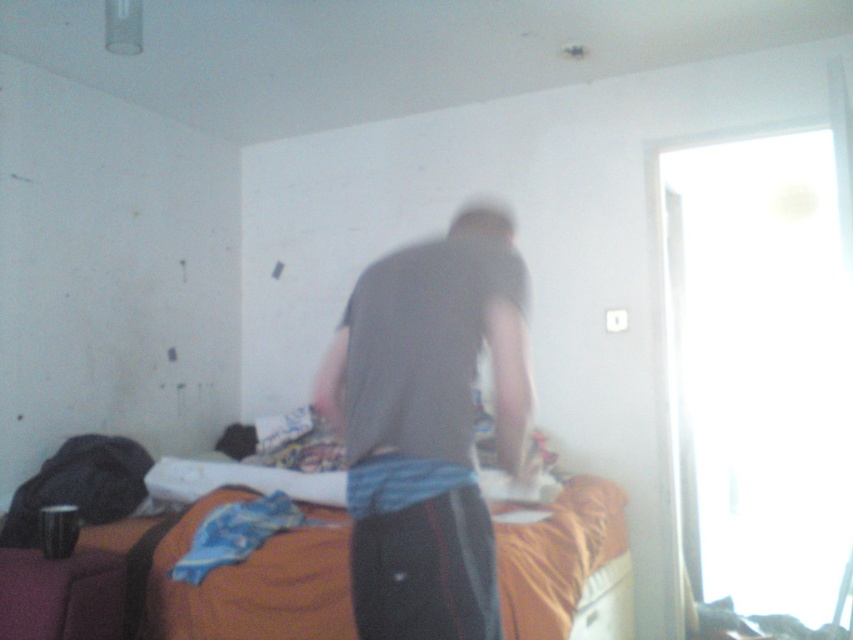
Question: Is dark gray shirt at center positioned in front of orange fabric bed at center?

Choices:
 (A) yes
 (B) no

Answer: (A)

Question: Which of the following is the closest to the observer?

Choices:
 (A) orange fabric bed at center
 (B) dark gray shirt at center

Answer: (B)

Question: Does dark gray shirt at center come behind orange fabric bed at center?

Choices:
 (A) no
 (B) yes

Answer: (A)

Question: Among these points, which one is nearest to the camera?

Choices:
 (A) (386, 515)
 (B) (289, 532)

Answer: (A)

Question: Does dark gray shirt at center appear over orange fabric bed at center?

Choices:
 (A) no
 (B) yes

Answer: (B)